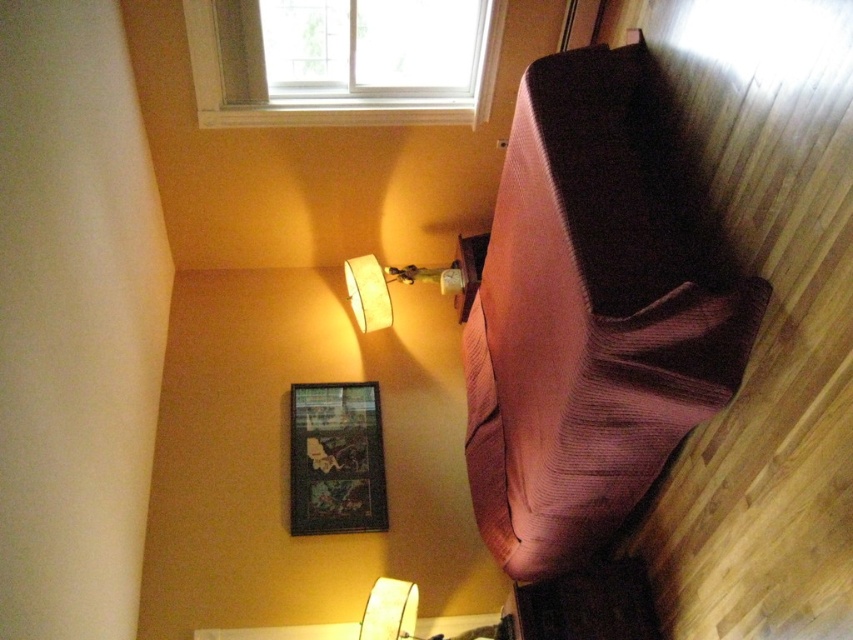
Question: Which point is farther from the camera taking this photo?

Choices:
 (A) (456, 276)
 (B) (630, 342)
 (C) (480, 45)

Answer: (A)

Question: Which of these objects is positioned farthest from the pink corduroy sleeping bag at right?

Choices:
 (A) white fabric lampshade at upper center
 (B) white plastic window at upper center

Answer: (B)

Question: Is pink corduroy sleeping bag at right wider than white plastic window at upper center?

Choices:
 (A) yes
 (B) no

Answer: (B)

Question: Is pink corduroy sleeping bag at right wider than white plastic window at upper center?

Choices:
 (A) no
 (B) yes

Answer: (A)

Question: Which of the following is the farthest from the observer?

Choices:
 (A) white fabric lampshade at upper center
 (B) white plastic window at upper center

Answer: (A)

Question: Is pink corduroy sleeping bag at right to the right of white plastic window at upper center from the viewer's perspective?

Choices:
 (A) yes
 (B) no

Answer: (A)